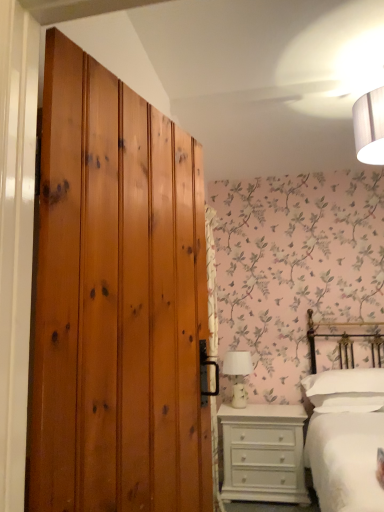
I want to click on vacant area that lies to the right of white ceramic table lamp at center, so click(x=274, y=405).